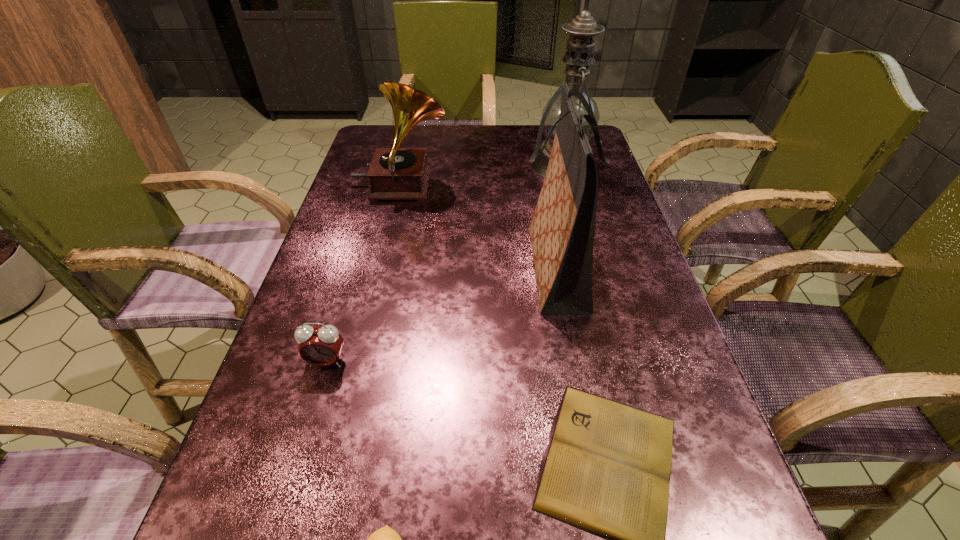
At what (x,y) coordinates should I click in order to perform the action: click on oil lamp. Please return your answer as a coordinate pair (x, y). Image resolution: width=960 pixels, height=540 pixels. Looking at the image, I should click on (579, 54).

Locate an element on the screen. The width and height of the screenshot is (960, 540). the third farthest object is located at coordinates (562, 229).

I want to click on phonograph record, so click(395, 173).

The height and width of the screenshot is (540, 960). I want to click on the third nearest object, so click(321, 346).

Identify the location of alarm clock. (321, 346).

Locate an element on the screen. vacant space situated on the front of the oil lamp is located at coordinates (599, 298).

This screenshot has width=960, height=540. What are the coordinates of `blank space located 0.400m on the front-facing side of the fourth nearest object` in the screenshot? It's located at (338, 267).

Locate an element on the screen. vacant space located on the front-facing side of the fourth nearest object is located at coordinates (411, 267).

Where is `free space located on the front-facing side of the fourth nearest object`? This screenshot has height=540, width=960. free space located on the front-facing side of the fourth nearest object is located at coordinates (384, 267).

At what (x,y) coordinates should I click in order to perform the action: click on free space located 0.250m from the horn of the third tallest object. Please return your answer as a coordinate pair (x, y). Image resolution: width=960 pixels, height=540 pixels. Looking at the image, I should click on (540, 186).